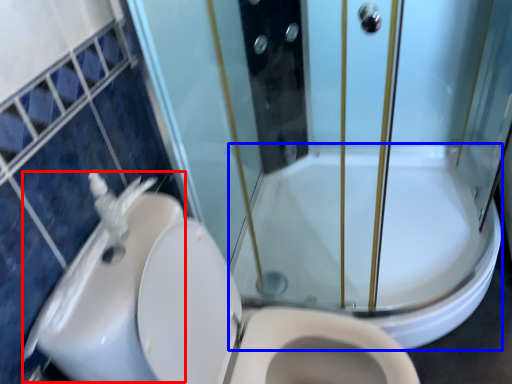
Question: Which point is closer to the camera, sink (highlighted by a red box) or bath (highlighted by a blue box)?

Choices:
 (A) sink
 (B) bath

Answer: (A)